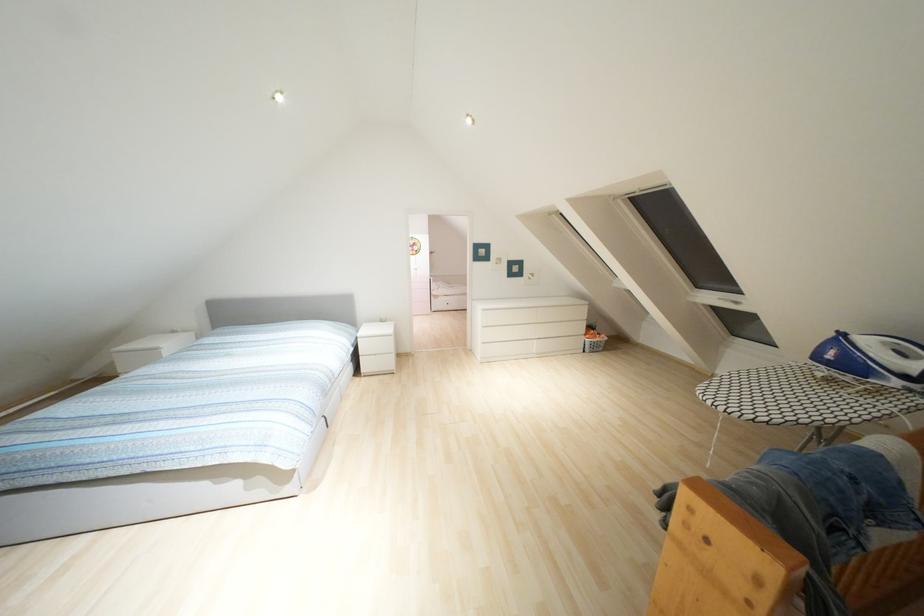
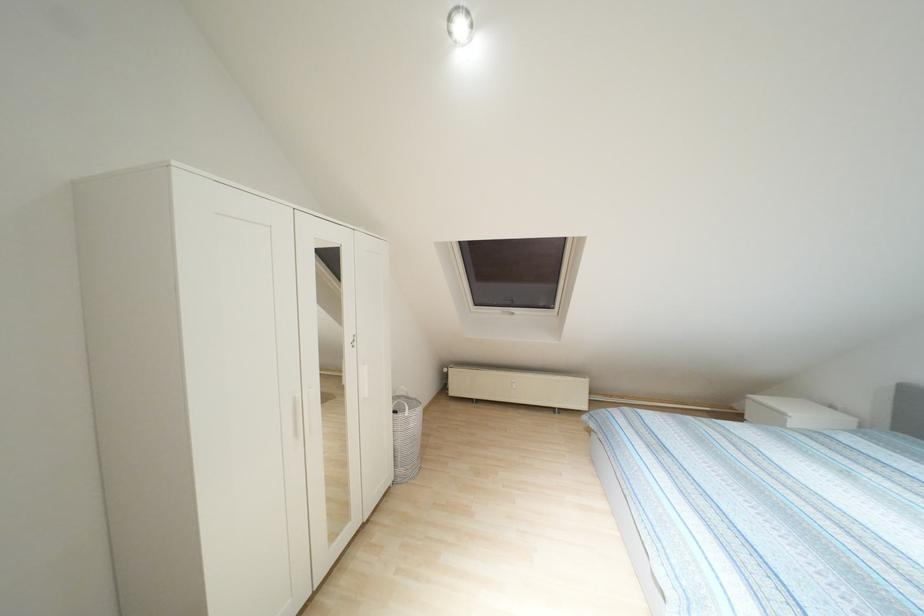
Question: The camera is either moving clockwise (left) or counter-clockwise (right) around the object. The first image is from the beginning of the video and the second image is from the end. Is the camera moving left or right when shooting the video?

Choices:
 (A) Left
 (B) Right

Answer: (B)